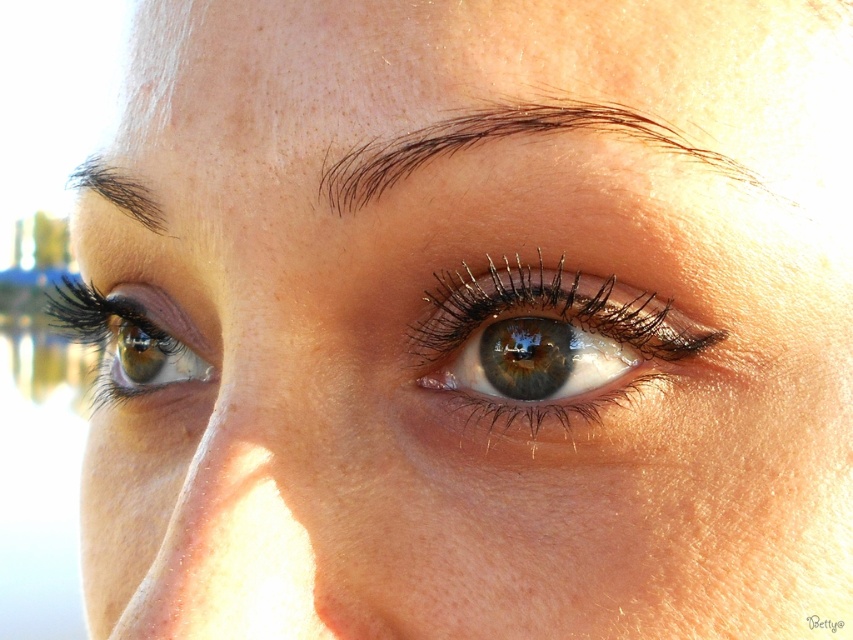
Between brown matte eye at center and brown hair at upper center, which one is positioned lower?

brown matte eye at center is below.

Who is higher up, brown matte eye at center or brown hair at upper center?

brown hair at upper center is higher up.

The width and height of the screenshot is (853, 640). Describe the element at coordinates (546, 340) in the screenshot. I see `brown matte eye at center` at that location.

This screenshot has height=640, width=853. What are the coordinates of `brown matte eye at center` in the screenshot? It's located at (546, 340).

Between matte brown eye at lower left and dark brown hair at upper left, which one has less height?

dark brown hair at upper left

Is matte brown eye at lower left closer to camera compared to dark brown hair at upper left?

No.

Which is in front, point (151, 348) or point (144, 216)?

Positioned in front is point (144, 216).

Locate an element on the screen. Image resolution: width=853 pixels, height=640 pixels. matte brown eye at lower left is located at coordinates (123, 342).

Who is positioned more to the right, brown hair at upper center or matte brown eye at lower left?

From the viewer's perspective, brown hair at upper center appears more on the right side.

Who is positioned more to the left, brown hair at upper center or matte brown eye at lower left?

matte brown eye at lower left

Which is behind, point (498, 120) or point (172, 346)?

The point (172, 346) is more distant.

Find the location of a particular element. brown hair at upper center is located at coordinates (500, 138).